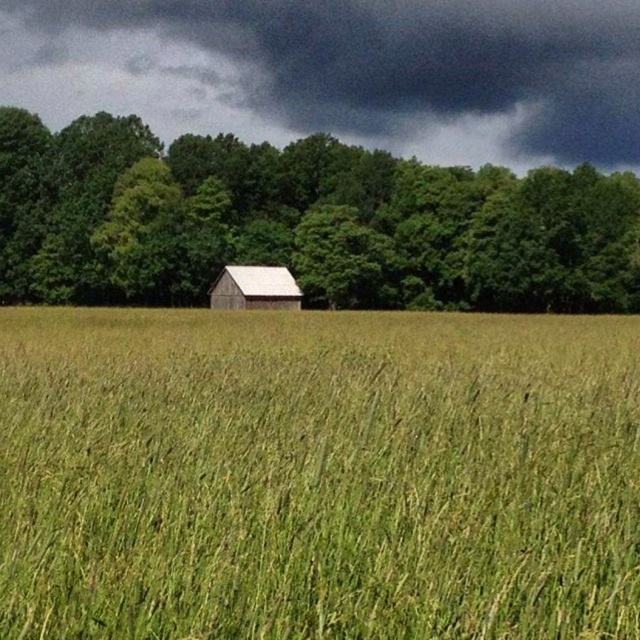
Can you confirm if green grassy wheat field at center is taller than dark gray cloud at upper center?

In fact, green grassy wheat field at center may be shorter than dark gray cloud at upper center.

Is green grassy wheat field at center wider than dark gray cloud at upper center?

No, green grassy wheat field at center is not wider than dark gray cloud at upper center.

The image size is (640, 640). Find the location of `green grassy wheat field at center`. green grassy wheat field at center is located at coordinates (317, 476).

Where is `green grassy wheat field at center`? This screenshot has height=640, width=640. green grassy wheat field at center is located at coordinates (317, 476).

Does point (572, 228) come in front of point (188, 84)?

That is True.

Who is more distant from viewer, (204, 212) or (374, 76)?

→ The point (374, 76) is more distant.

Where is `green matte tree at center`? This screenshot has height=640, width=640. green matte tree at center is located at coordinates (301, 221).

Which is behind, point (163, 342) or point (572, 284)?

The point (572, 284) is more distant.

Does green grassy wheat field at center lie in front of green matte tree at center?

That is True.

Between point (132, 595) and point (353, 176), which one is positioned in front?

Positioned in front is point (132, 595).

Locate an element on the screen. This screenshot has width=640, height=640. green grassy wheat field at center is located at coordinates (317, 476).